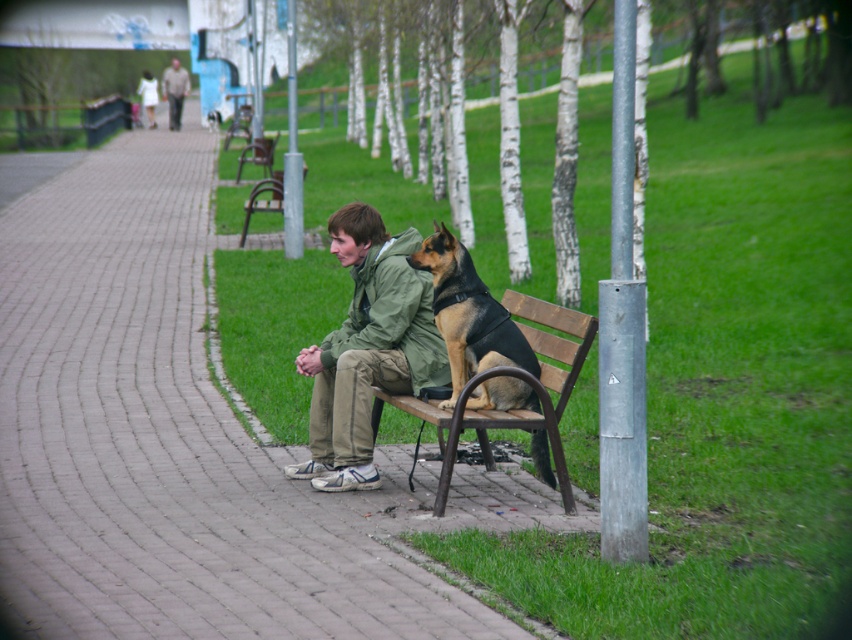
You are standing on the paved pathway in the park scene. You notice two points marked on the pathway. The first point is at coordinates point [346,413] and the second point is at point [258,147]. Which point is nearer to your current position?

The point [346,413] is closer to the viewer than the point [258,147].

You are a photographer wanting to capture both the black leather dog at center and the camouflage fabric jacket at upper center in a single frame. Given the camera you have can only focus on objects within a 1.5 meter width, will both objects fit in the frame?

The black leather dog at center is wider than the camouflage fabric jacket at upper center. Since the camera can focus on objects within a 1.5 meter width, both objects can fit in the frame as long as their combined width does not exceed 1.5 meters. However, the exact fit depends on their individual widths and positioning.